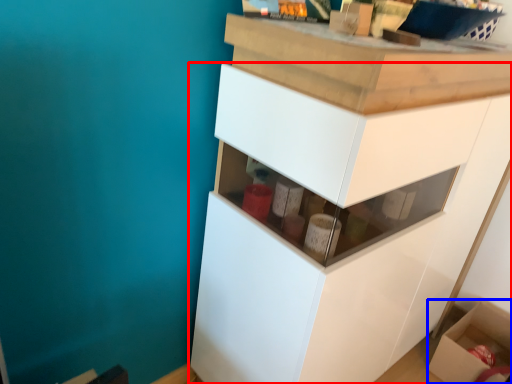
Question: Which point is closer to the camera, cabinetry (highlighted by a red box) or cardboard box (highlighted by a blue box)?

Choices:
 (A) cabinetry
 (B) cardboard box

Answer: (A)